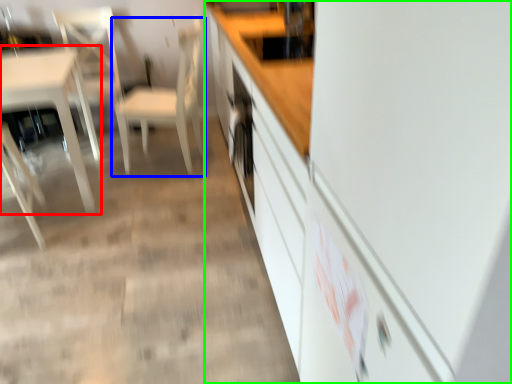
Question: Which object is the farthest from table (highlighted by a red box)? Choose among these: chair (highlighted by a blue box) or cabinetry (highlighted by a green box).

Choices:
 (A) chair
 (B) cabinetry

Answer: (B)